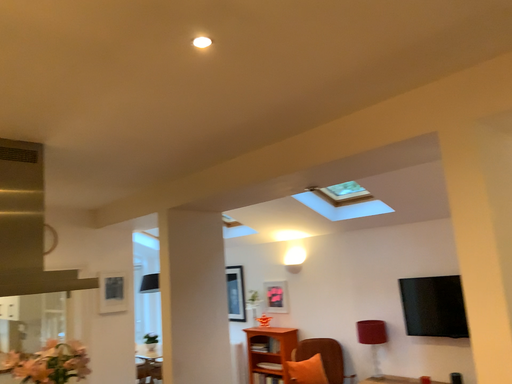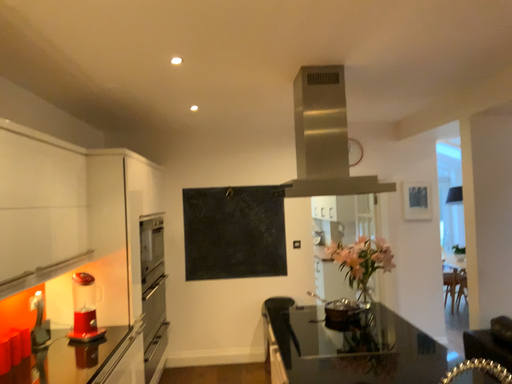
Question: How did the camera likely rotate when shooting the video?

Choices:
 (A) rotated downward
 (B) rotated upward

Answer: (A)